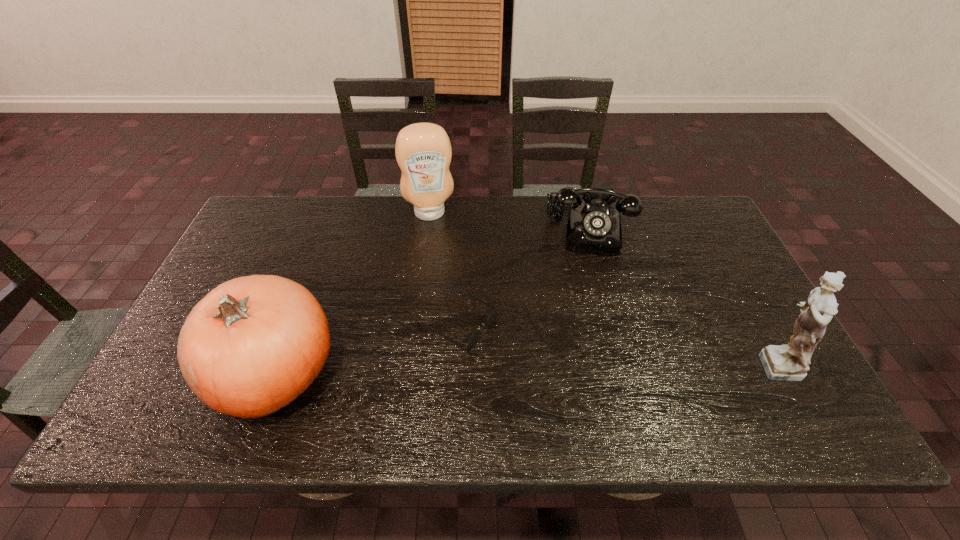
Where is `vacant space on the desktop that is between the pumpkin and the figurine and is positioned on the label of the condiment`? This screenshot has width=960, height=540. vacant space on the desktop that is between the pumpkin and the figurine and is positioned on the label of the condiment is located at coordinates (453, 368).

The width and height of the screenshot is (960, 540). I want to click on free space on the desktop that is between the pumpkin and the figurine and is positioned on the dial of the telephone, so click(588, 366).

You are a GUI agent. You are given a task and a screenshot of the screen. Output one action in this format:
    pyautogui.click(x=<x>, y=<y>)
    Task: Click on the vacant space on the desktop that is between the leftmost object and the rightmost object and is positioned on the front-facing side of the sunglasses
    The height and width of the screenshot is (540, 960).
    Given the screenshot: What is the action you would take?
    pyautogui.click(x=539, y=367)